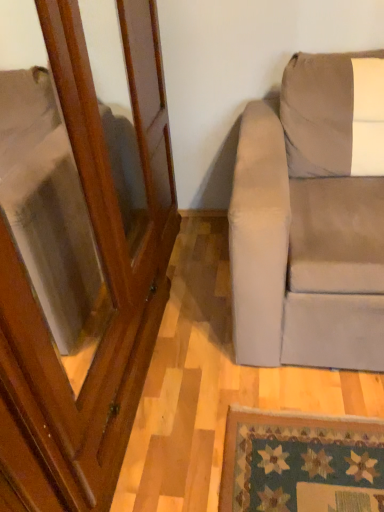
Question: From a real-world perspective, is wooden screen door at left physically located above or below suede beige couch at right?

Choices:
 (A) below
 (B) above

Answer: (B)

Question: From the image's perspective, is wooden screen door at left above or below suede beige couch at right?

Choices:
 (A) below
 (B) above

Answer: (A)

Question: Is wooden screen door at left inside the boundaries of suede beige couch at right, or outside?

Choices:
 (A) outside
 (B) inside

Answer: (A)

Question: Based on their sizes in the image, would you say suede beige couch at right is bigger or smaller than wooden screen door at left?

Choices:
 (A) small
 (B) big

Answer: (A)

Question: From the image's perspective, is suede beige couch at right located above or below wooden screen door at left?

Choices:
 (A) above
 (B) below

Answer: (A)

Question: Considering the relative positions of suede beige couch at right and wooden screen door at left in the image provided, is suede beige couch at right to the left or to the right of wooden screen door at left?

Choices:
 (A) left
 (B) right

Answer: (B)

Question: Is suede beige couch at right wider or thinner than wooden screen door at left?

Choices:
 (A) wide
 (B) thin

Answer: (A)